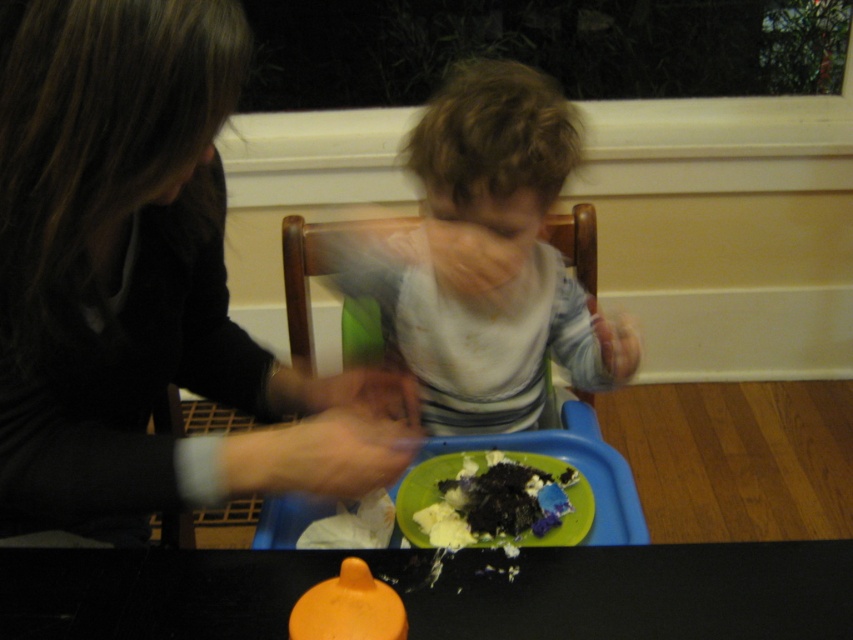
What are the coordinates of the black plastic table at lower center?

The black plastic table at lower center is located at coordinates point (440, 592).

You are a parent trying to clean up after a messy meal. You have a dark crumbly cake at lower center that needs to be moved away from the black plastic table at lower center. How far apart are these two items currently?

The dark crumbly cake at lower center and the black plastic table at lower center are 8.46 inches apart.